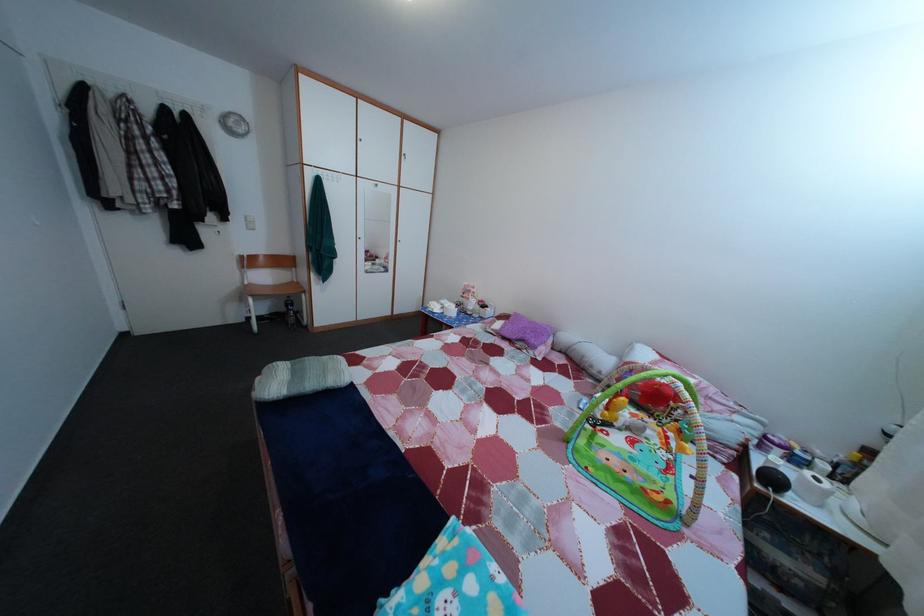
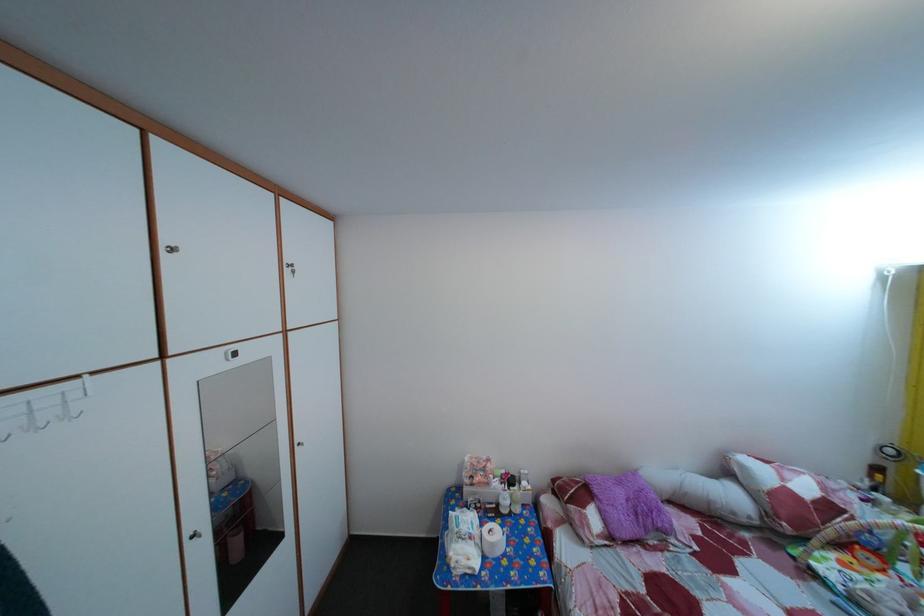
The point at [541,330] is marked in the first image. Where is the corresponding point in the second image?

(629, 491)